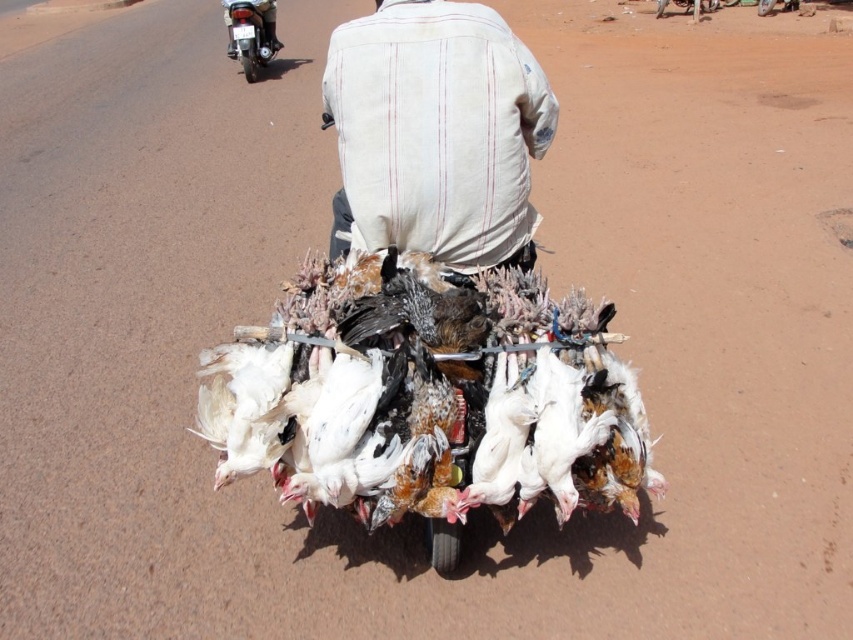
Which is above, white feathered chicken at center or brushed metal motorcycle at upper left?

brushed metal motorcycle at upper left is higher up.

Who is shorter, white feathered chicken at center or brushed metal motorcycle at upper left?

Standing shorter between the two is white feathered chicken at center.

Describe the element at coordinates (426, 401) in the screenshot. I see `white feathered chicken at center` at that location.

I want to click on white feathered chicken at center, so click(x=426, y=401).

Is white striped shirt at center thinner than brushed metal motorcycle at upper left?

No, white striped shirt at center is not thinner than brushed metal motorcycle at upper left.

Can you confirm if white striped shirt at center is shorter than brushed metal motorcycle at upper left?

Correct, white striped shirt at center is not as tall as brushed metal motorcycle at upper left.

Does point (527, 100) come farther from viewer compared to point (235, 45)?

No, (527, 100) is closer to viewer.

At what (x,y) coordinates should I click in order to perform the action: click on white striped shirt at center. Please return your answer as a coordinate pair (x, y). Image resolution: width=853 pixels, height=640 pixels. Looking at the image, I should click on (434, 132).

Is white feathered chicken at center smaller than white striped shirt at center?

Yes, white feathered chicken at center is smaller than white striped shirt at center.

Which is in front, point (347, 483) or point (479, 241)?

Point (347, 483)

What do you see at coordinates (426, 401) in the screenshot? The width and height of the screenshot is (853, 640). I see `white feathered chicken at center` at bounding box center [426, 401].

Locate an element on the screen. The width and height of the screenshot is (853, 640). white feathered chicken at center is located at coordinates (426, 401).